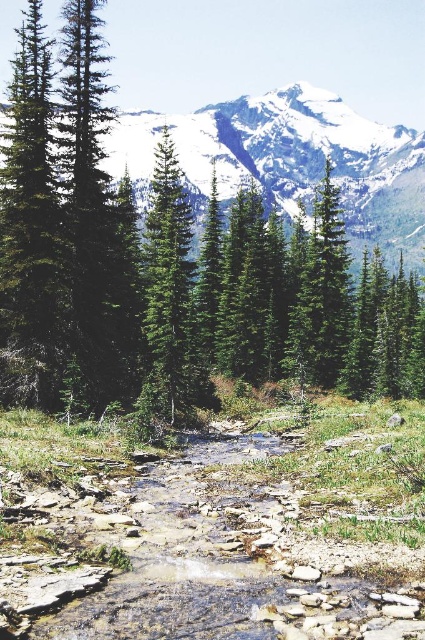
You are standing at the edge of the stream and want to take a photo of the green matte tree at center and the snowy granite mountain at upper center. Which object will appear larger in the photo?

The green matte tree at center will appear larger in the photo because it is positioned under the snowy granite mountain at upper center, meaning it is closer to the camera than the mountain.

You are standing at the edge of the stream in the forest scene. You notice two points marked in the image. Which point, point (169, 637) or point (399, 170), is closer to your current position?

Point (169, 637) is closer to the viewer than point (399, 170), so the closer point to your current position is point (169, 637).